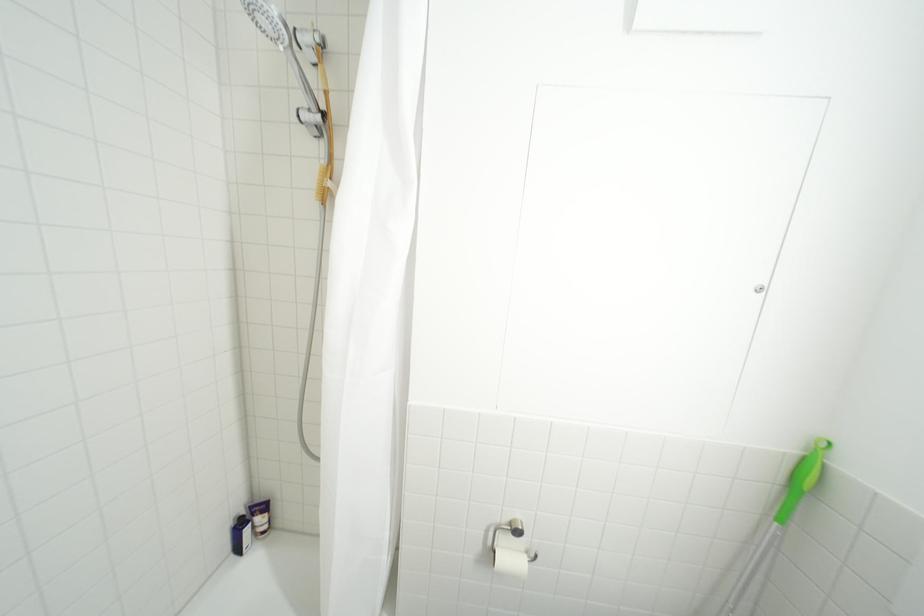
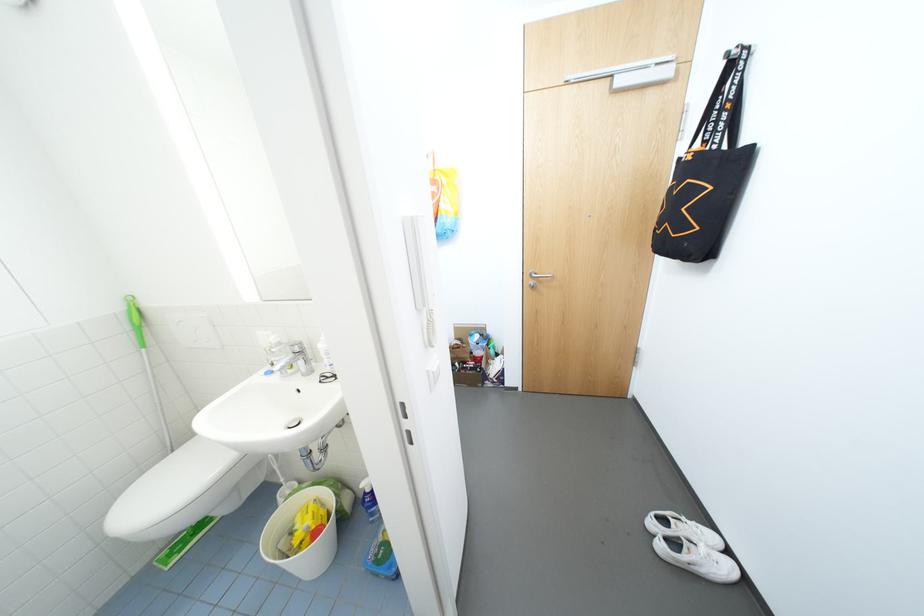
The point at (800, 451) is marked in the first image. Where is the corresponding point in the second image?

(126, 310)